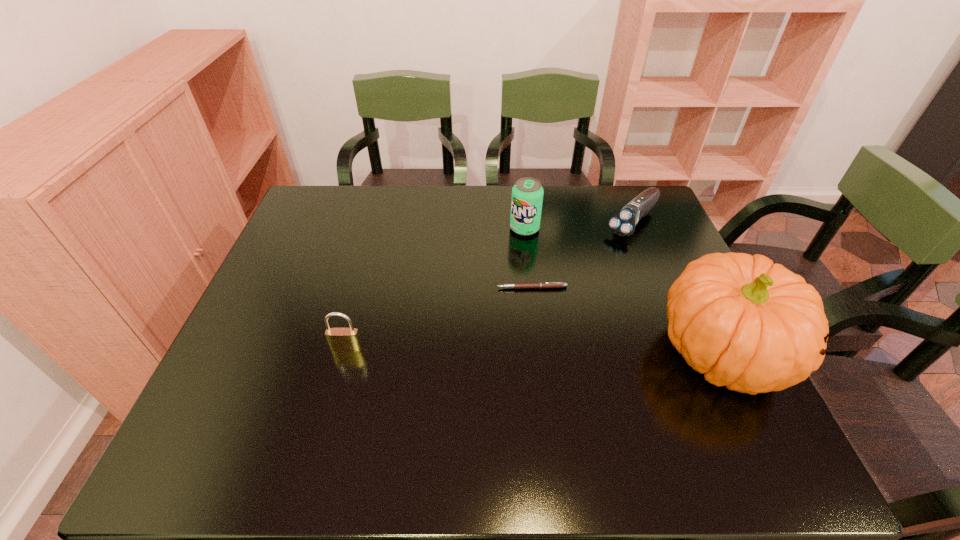
Where is `the leftmost object`? the leftmost object is located at coordinates (339, 339).

Where is `padlock`? padlock is located at coordinates (339, 339).

Identify the location of the tallest object. pyautogui.click(x=753, y=326).

The width and height of the screenshot is (960, 540). In order to click on the second shortest object in this screenshot , I will do `click(623, 223)`.

The height and width of the screenshot is (540, 960). I want to click on the fourth shortest object, so click(527, 194).

I want to click on pen, so click(x=542, y=284).

You are a GUI agent. You are given a task and a screenshot of the screen. Output one action in this format:
    pyautogui.click(x=<x>, y=<y>)
    Task: Click on the third nearest object
    The image size is (960, 540).
    Given the screenshot: What is the action you would take?
    pyautogui.click(x=542, y=284)

Identify the location of vacant space located on the front-facing side of the leftmost object. The image size is (960, 540). (328, 416).

The image size is (960, 540). What are the coordinates of `vacant area situated on the head of the fourth tallest object` in the screenshot? It's located at (598, 259).

Where is `vacant space positioned 0.190m on the head of the fourth tallest object`? vacant space positioned 0.190m on the head of the fourth tallest object is located at coordinates (585, 272).